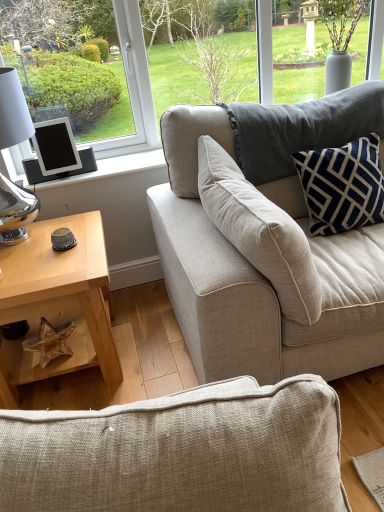
Question: From a real-world perspective, is black matte tablet at left over beige fabric couch at upper right?

Choices:
 (A) no
 (B) yes

Answer: (B)

Question: Is black matte tablet at left at the right side of beige fabric couch at upper right?

Choices:
 (A) no
 (B) yes

Answer: (A)

Question: From a real-world perspective, is black matte tablet at left physically below beige fabric couch at upper right?

Choices:
 (A) no
 (B) yes

Answer: (A)

Question: Does black matte tablet at left have a greater width compared to beige fabric couch at upper right?

Choices:
 (A) yes
 (B) no

Answer: (B)

Question: From the image's perspective, is black matte tablet at left located above beige fabric couch at upper right?

Choices:
 (A) yes
 (B) no

Answer: (A)

Question: From a real-world perspective, relative to black matte tablet at left, is beige fabric couch at upper right vertically above or below?

Choices:
 (A) below
 (B) above

Answer: (A)

Question: Considering the positions of beige fabric couch at upper right and black matte tablet at left in the image, is beige fabric couch at upper right taller or shorter than black matte tablet at left?

Choices:
 (A) short
 (B) tall

Answer: (B)

Question: Is beige fabric couch at upper right inside the boundaries of black matte tablet at left, or outside?

Choices:
 (A) outside
 (B) inside

Answer: (A)

Question: Is point (279, 309) closer or farther from the camera than point (57, 166)?

Choices:
 (A) farther
 (B) closer

Answer: (B)

Question: Is navy velvet pillow at upper right spatially inside light wood/texture coffee table at lower left, or outside of it?

Choices:
 (A) inside
 (B) outside

Answer: (B)

Question: Does point (312, 165) appear closer or farther from the camera than point (91, 279)?

Choices:
 (A) closer
 (B) farther

Answer: (B)

Question: Considering the positions of navy velvet pillow at upper right and light wood/texture coffee table at lower left in the image, is navy velvet pillow at upper right bigger or smaller than light wood/texture coffee table at lower left?

Choices:
 (A) big
 (B) small

Answer: (B)

Question: Visually, is navy velvet pillow at upper right positioned to the left or to the right of light wood/texture coffee table at lower left?

Choices:
 (A) left
 (B) right

Answer: (B)

Question: Considering the relative positions of light wood/texture coffee table at lower left and navy velvet pillow at upper right in the image provided, is light wood/texture coffee table at lower left to the left or to the right of navy velvet pillow at upper right?

Choices:
 (A) left
 (B) right

Answer: (A)

Question: Choose the correct answer: Is light wood/texture coffee table at lower left inside navy velvet pillow at upper right or outside it?

Choices:
 (A) outside
 (B) inside

Answer: (A)